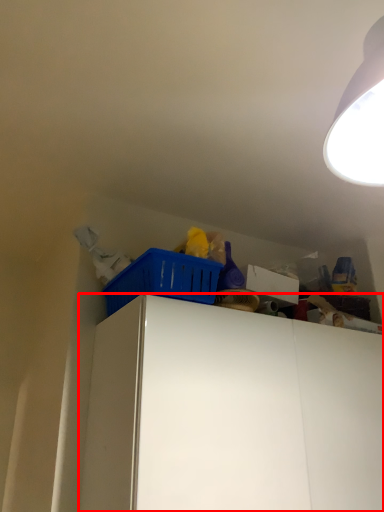
Question: From the image's perspective, where is cabinetry (annotated by the red box) located relative to basket?

Choices:
 (A) below
 (B) above

Answer: (A)